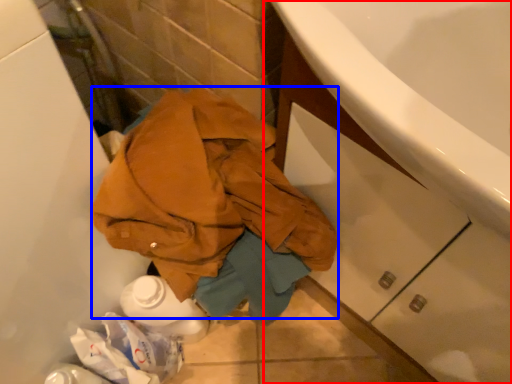
Question: Which of the following is the closest to the observer, bathroom cabinet (highlighted by a red box) or clothing (highlighted by a blue box)?

Choices:
 (A) bathroom cabinet
 (B) clothing

Answer: (A)